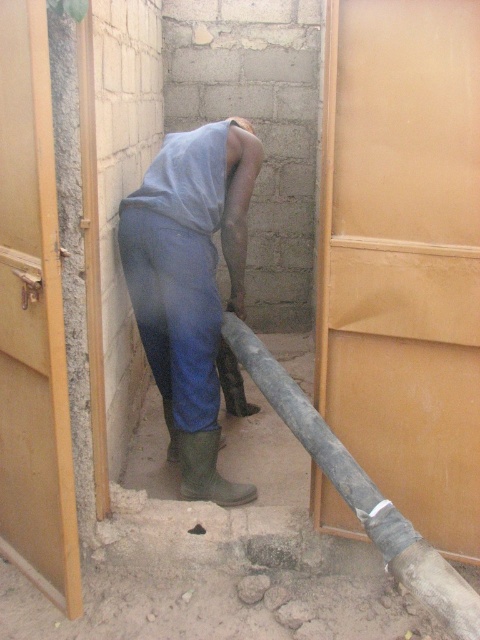
You are a construction worker in the room. You need to place a tool box at point (x=191, y=284). However, there is an object there. What object is at that point?

The blue denim pants at center are located at point (x=191, y=284).

You are a construction worker who needs to place a protective cover over the smooth concrete hole at lower center. The cover you have is the same size as your blue denim pants at center. Will the cover fit over the hole?

The blue denim pants at center has a larger size compared to smooth concrete hole at lower center, so the cover, being the same size as the blue denim pants at center, will fit over the hole.

You are a contractor assessing the workspace in this room. You need to ensure there is enough space between the blue denim pants at center and the rusty metallic pipe at center for a 1.2 meter wide equipment. Can you fit it?

The blue denim pants at center occupies less space than the rusty metallic pipe at center, but the description does not provide specific measurements of the space between them. Therefore, it is unclear if the 1.2 meter wide equipment can fit between them.